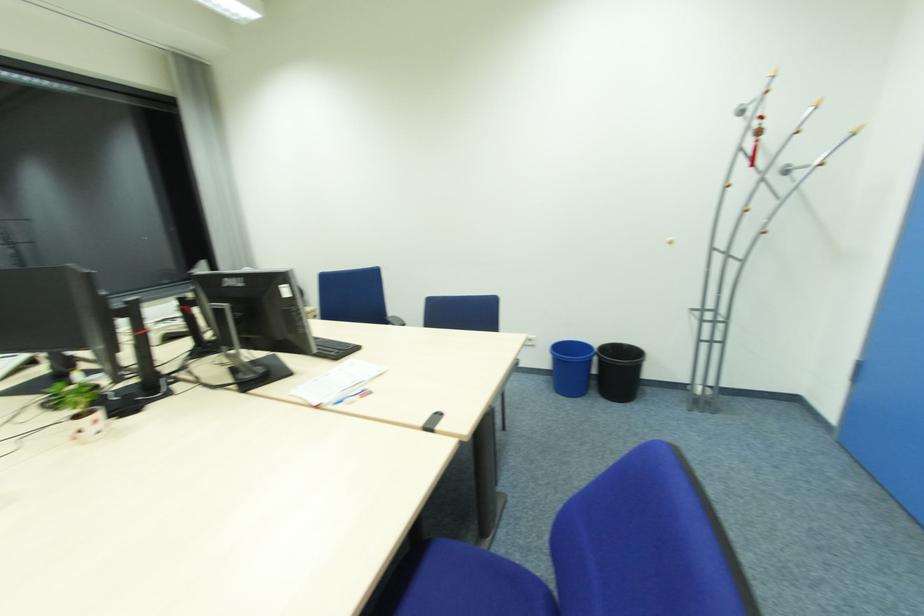
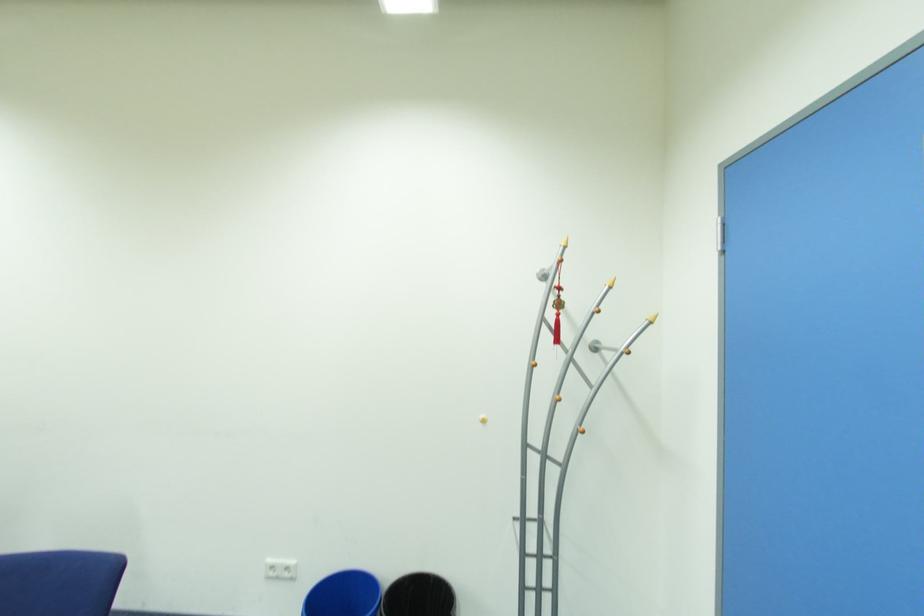
The first image is from the beginning of the video and the second image is from the end. How did the camera likely rotate when shooting the video?

The camera rotated toward right-up.